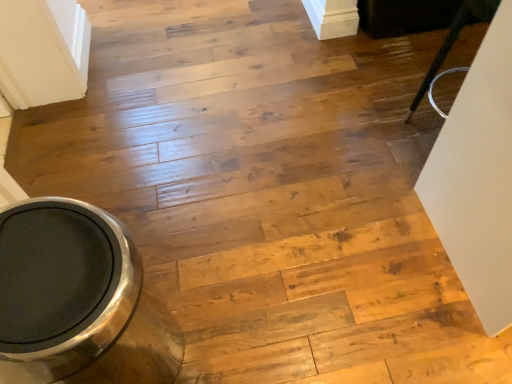
Where is `black glossy chair at upper right`? Image resolution: width=512 pixels, height=384 pixels. black glossy chair at upper right is located at coordinates (453, 42).

The width and height of the screenshot is (512, 384). Describe the element at coordinates (453, 42) in the screenshot. I see `black glossy chair at upper right` at that location.

Where is `polished stainless steel toilet bowl at lower left`? polished stainless steel toilet bowl at lower left is located at coordinates (62, 287).

The width and height of the screenshot is (512, 384). Describe the element at coordinates (62, 287) in the screenshot. I see `polished stainless steel toilet bowl at lower left` at that location.

In order to face polished stainless steel toilet bowl at lower left, should I rotate leftwards or rightwards?

You should rotate left by 20.962 degrees.

Locate an element on the screen. The width and height of the screenshot is (512, 384). black glossy chair at upper right is located at coordinates (453, 42).

Based on the photo, considering the relative positions of polished stainless steel toilet bowl at lower left and black glossy chair at upper right in the image provided, is polished stainless steel toilet bowl at lower left to the left of black glossy chair at upper right from the viewer's perspective?

Yes, polished stainless steel toilet bowl at lower left is to the left of black glossy chair at upper right.

Looking at this image, is polished stainless steel toilet bowl at lower left closer to camera compared to black glossy chair at upper right?

Yes, polished stainless steel toilet bowl at lower left is closer to the viewer.

Does point (52, 317) lie behind point (441, 54)?

No, (52, 317) is in front of (441, 54).

From the image's perspective, is polished stainless steel toilet bowl at lower left positioned above or below black glossy chair at upper right?

Based on their image positions, polished stainless steel toilet bowl at lower left is located beneath black glossy chair at upper right.

From a real-world perspective, between polished stainless steel toilet bowl at lower left and black glossy chair at upper right, who is vertically higher?

black glossy chair at upper right is physically above.

Is polished stainless steel toilet bowl at lower left wider or thinner than black glossy chair at upper right?

Clearly, polished stainless steel toilet bowl at lower left has more width compared to black glossy chair at upper right.

Considering the sizes of objects polished stainless steel toilet bowl at lower left and black glossy chair at upper right in the image provided, who is taller, polished stainless steel toilet bowl at lower left or black glossy chair at upper right?

polished stainless steel toilet bowl at lower left is taller.

Does polished stainless steel toilet bowl at lower left have a larger size compared to black glossy chair at upper right?

Yes.

Is black glossy chair at upper right inside polished stainless steel toilet bowl at lower left?

No, black glossy chair at upper right is not surrounded by polished stainless steel toilet bowl at lower left.

Is polished stainless steel toilet bowl at lower left not near black glossy chair at upper right?

Yes.

Could you tell me if polished stainless steel toilet bowl at lower left is turned towards black glossy chair at upper right?

No, polished stainless steel toilet bowl at lower left is not turned towards black glossy chair at upper right.

How many degrees apart are the facing directions of polished stainless steel toilet bowl at lower left and black glossy chair at upper right?

The facing directions of polished stainless steel toilet bowl at lower left and black glossy chair at upper right are 89.2 degrees apart.

Identify the location of toilet bowl in front of the black glossy chair at upper right. (62, 287).

From the picture: Considering the relative positions of black glossy chair at upper right and polished stainless steel toilet bowl at lower left in the image provided, is black glossy chair at upper right to the left or to the right of polished stainless steel toilet bowl at lower left?

black glossy chair at upper right is to the right of polished stainless steel toilet bowl at lower left.

Is black glossy chair at upper right in front of or behind polished stainless steel toilet bowl at lower left in the image?

Clearly, black glossy chair at upper right is behind polished stainless steel toilet bowl at lower left.

Which is less distant, (460, 10) or (40, 206)?

The point (40, 206) is in front.

From the image's perspective, which one is positioned higher, black glossy chair at upper right or polished stainless steel toilet bowl at lower left?

black glossy chair at upper right appears higher in the image.

From a real-world perspective, which object rests below the other?

polished stainless steel toilet bowl at lower left, from a real-world perspective.

In terms of width, does black glossy chair at upper right look wider or thinner when compared to polished stainless steel toilet bowl at lower left?

Clearly, black glossy chair at upper right has less width compared to polished stainless steel toilet bowl at lower left.

Is black glossy chair at upper right taller or shorter than polished stainless steel toilet bowl at lower left?

Clearly, black glossy chair at upper right is shorter compared to polished stainless steel toilet bowl at lower left.

Does black glossy chair at upper right have a smaller size compared to polished stainless steel toilet bowl at lower left?

Indeed, black glossy chair at upper right has a smaller size compared to polished stainless steel toilet bowl at lower left.

Would you say black glossy chair at upper right is inside or outside polished stainless steel toilet bowl at lower left?

black glossy chair at upper right is not inside polished stainless steel toilet bowl at lower left, it's outside.

Is black glossy chair at upper right beside polished stainless steel toilet bowl at lower left?

black glossy chair at upper right and polished stainless steel toilet bowl at lower left are clearly separated.

Does black glossy chair at upper right turn towards polished stainless steel toilet bowl at lower left?

No, black glossy chair at upper right does not turn towards polished stainless steel toilet bowl at lower left.

What's the angular difference between black glossy chair at upper right and polished stainless steel toilet bowl at lower left's facing directions?

black glossy chair at upper right and polished stainless steel toilet bowl at lower left are facing 89.2 degrees away from each other.

At what (x,y) coordinates should I click in order to perform the action: click on toilet bowl in front of the black glossy chair at upper right. Please return your answer as a coordinate pair (x, y). The width and height of the screenshot is (512, 384). Looking at the image, I should click on (62, 287).

I want to click on furniture above the polished stainless steel toilet bowl at lower left (from the image's perspective), so click(x=453, y=42).

Where is `toilet bowl that appears in front of the black glossy chair at upper right`? Image resolution: width=512 pixels, height=384 pixels. toilet bowl that appears in front of the black glossy chair at upper right is located at coordinates (62, 287).